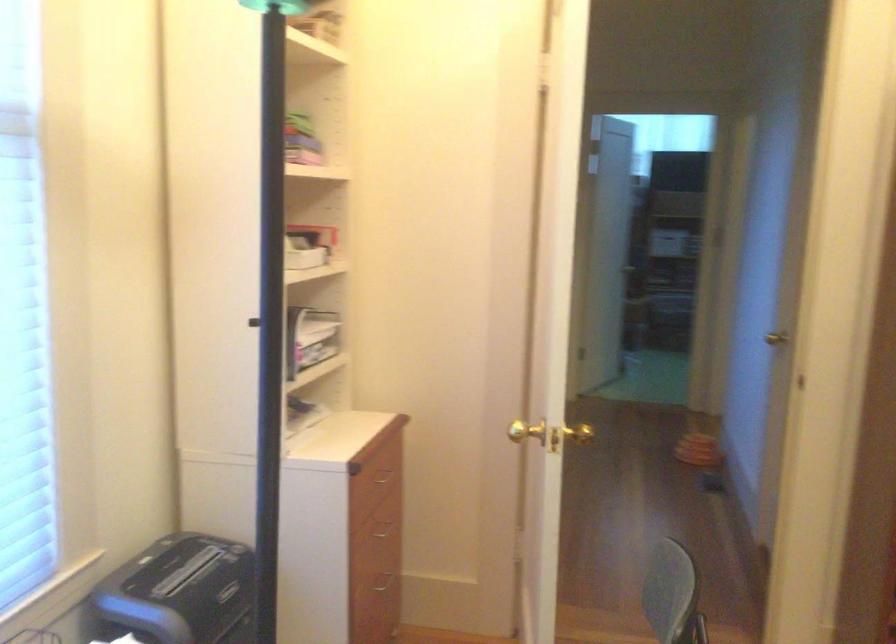
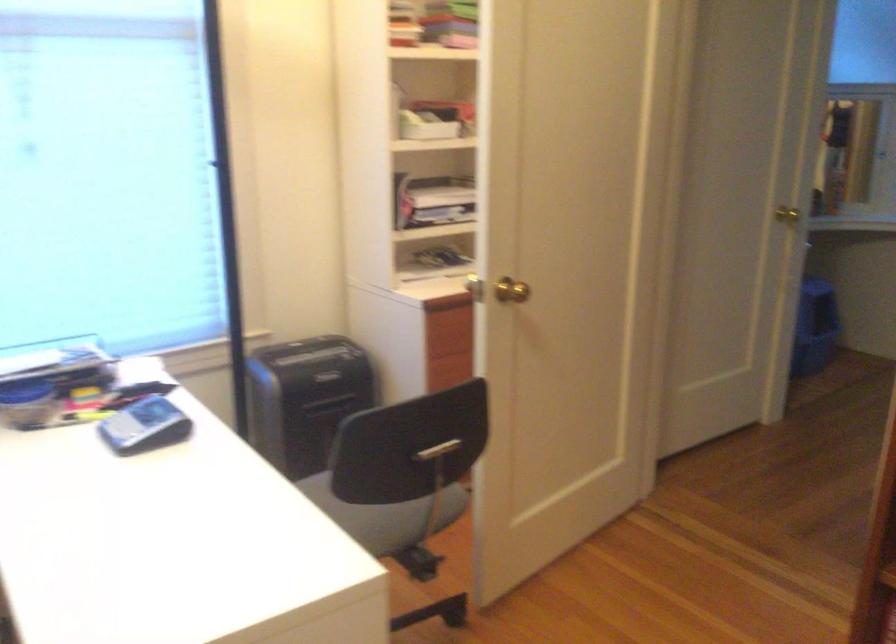
Question: I am providing you with two images of the same scene from different viewpoints. Which of the following objects are not visible in image2?

Choices:
 (A) drawer handle
 (B) grey calculator
 (C) chair sitting surface
 (D) metal weight plate

Answer: (A)